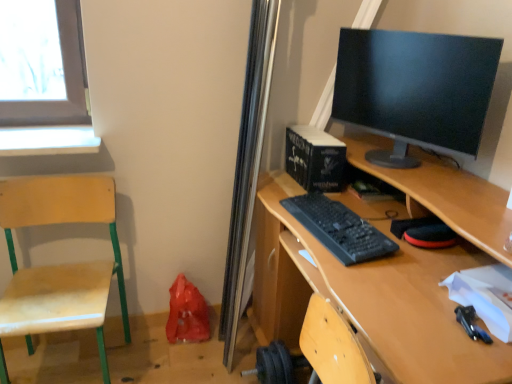
Question: Visually, is black glossy monitor at upper right positioned to the left or to the right of black plastic keyboard at center?

Choices:
 (A) right
 (B) left

Answer: (A)

Question: Looking at their shapes, would you say black glossy monitor at upper right is wider or thinner than black plastic keyboard at center?

Choices:
 (A) wide
 (B) thin

Answer: (B)

Question: Based on their relative distances, which object is farther from the wooden desk at center?

Choices:
 (A) black glossy monitor at upper right
 (B) black plastic keyboard at center
 (C) wooden swivel chair at left

Answer: (C)

Question: Based on their relative distances, which object is nearer to the black glossy monitor at upper right?

Choices:
 (A) wooden desk at center
 (B) black plastic keyboard at center
 (C) wooden swivel chair at left

Answer: (B)